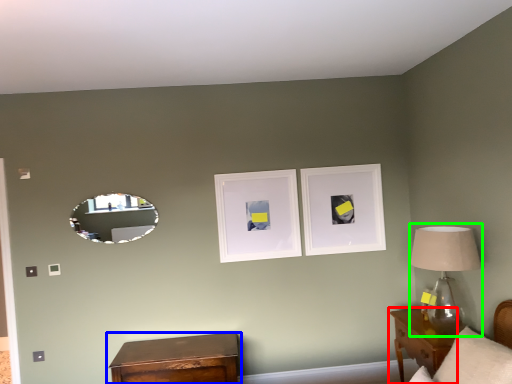
Question: Estimate the real-world distances between objects in this image. Which object is closer to nightstand (highlighted by a red box), nightstand (highlighted by a blue box) or table lamp (highlighted by a green box)?

Choices:
 (A) nightstand
 (B) table lamp

Answer: (B)